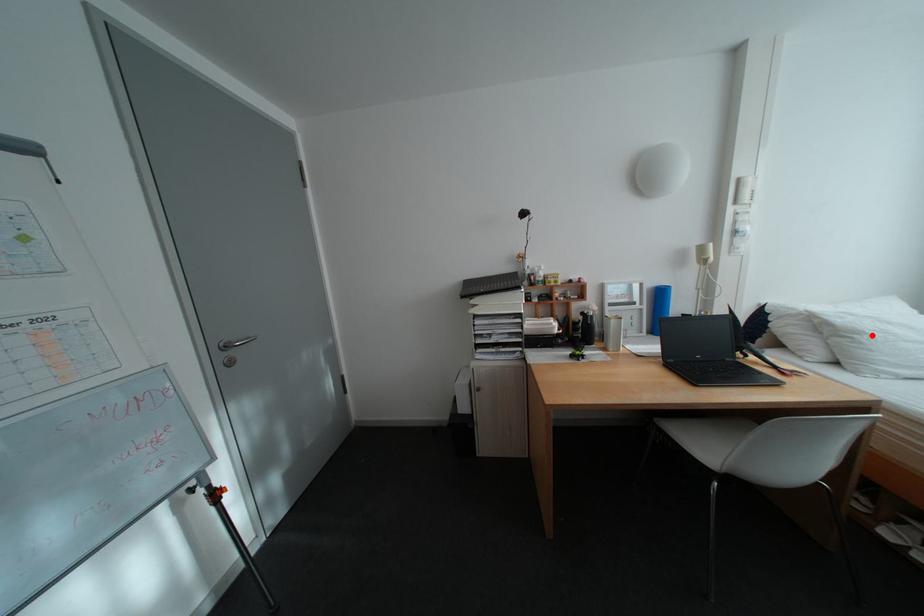
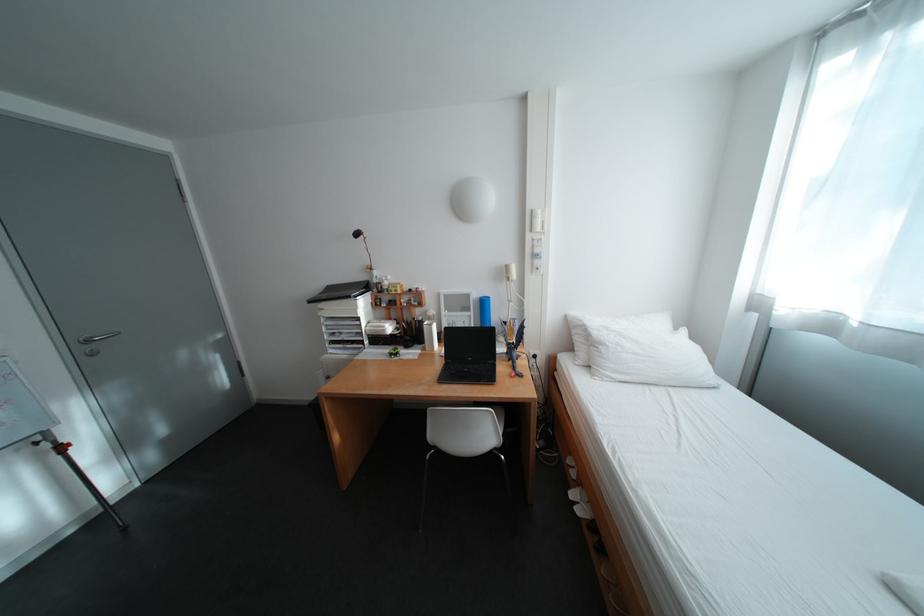
The point at the highlighted location is marked in the first image. Where is the corresponding point in the second image?

(614, 346)